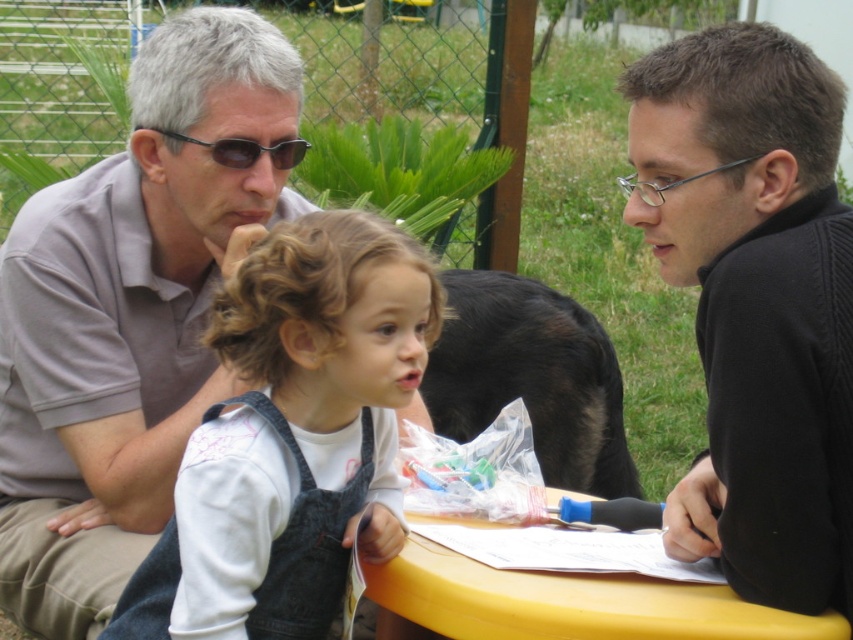
Is matte gray shirt at upper left above black plastic sunglasses at upper center?

Actually, matte gray shirt at upper left is below black plastic sunglasses at upper center.

Does matte gray shirt at upper left appear on the right side of black plastic sunglasses at upper center?

In fact, matte gray shirt at upper left is to the left of black plastic sunglasses at upper center.

Does point (103, 305) come farther from viewer compared to point (285, 154)?

Yes, point (103, 305) is behind point (285, 154).

The height and width of the screenshot is (640, 853). Find the location of `matte gray shirt at upper left`. matte gray shirt at upper left is located at coordinates (129, 314).

Is matte gray shirt at upper left thinner than black sweater at right?

No.

The height and width of the screenshot is (640, 853). Describe the element at coordinates (129, 314) in the screenshot. I see `matte gray shirt at upper left` at that location.

Find the location of a particular element. Image resolution: width=853 pixels, height=640 pixels. matte gray shirt at upper left is located at coordinates (129, 314).

Measure the distance between black sweater at right and denim overalls at center.

black sweater at right and denim overalls at center are 23.71 inches apart from each other.

Does point (827, 436) come farther from viewer compared to point (277, 291)?

No, (827, 436) is in front of (277, 291).

The image size is (853, 640). Describe the element at coordinates (755, 301) in the screenshot. I see `black sweater at right` at that location.

You are a GUI agent. You are given a task and a screenshot of the screen. Output one action in this format:
    pyautogui.click(x=<x>, y=<y>)
    Task: Click on the black sweater at right
    The height and width of the screenshot is (640, 853).
    Given the screenshot: What is the action you would take?
    pyautogui.click(x=755, y=301)